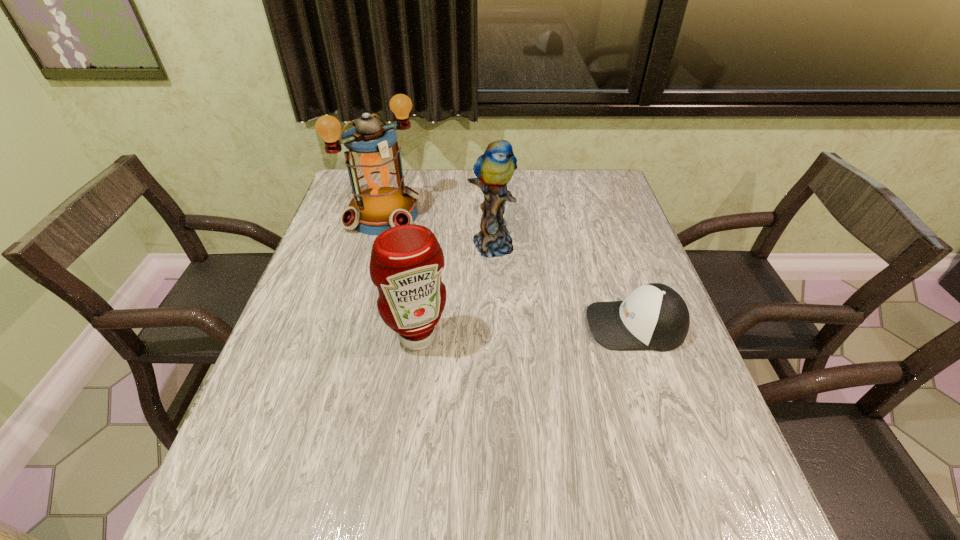
Where is `vacant region located 0.160m on the front-facing side of the lantern`? This screenshot has width=960, height=540. vacant region located 0.160m on the front-facing side of the lantern is located at coordinates (436, 259).

Where is `blank space located on the front-facing side of the lantern`? blank space located on the front-facing side of the lantern is located at coordinates (471, 289).

I want to click on free space located on the face of the third object from left to right, so click(x=564, y=345).

I want to click on free region located 0.310m on the face of the third object from left to right, so click(x=564, y=345).

Find the location of a particular element. This screenshot has height=540, width=960. vacant space situated on the face of the third object from left to right is located at coordinates (571, 355).

This screenshot has width=960, height=540. Find the location of `object at the far edge`. object at the far edge is located at coordinates (381, 200).

Identify the location of object at the left edge. (381, 200).

In order to click on object that is at the right edge in this screenshot , I will do `click(654, 316)`.

Locate an element on the screen. The image size is (960, 540). object that is at the far left corner is located at coordinates (381, 200).

Where is `vacant area at the far edge of the desktop`? vacant area at the far edge of the desktop is located at coordinates (426, 183).